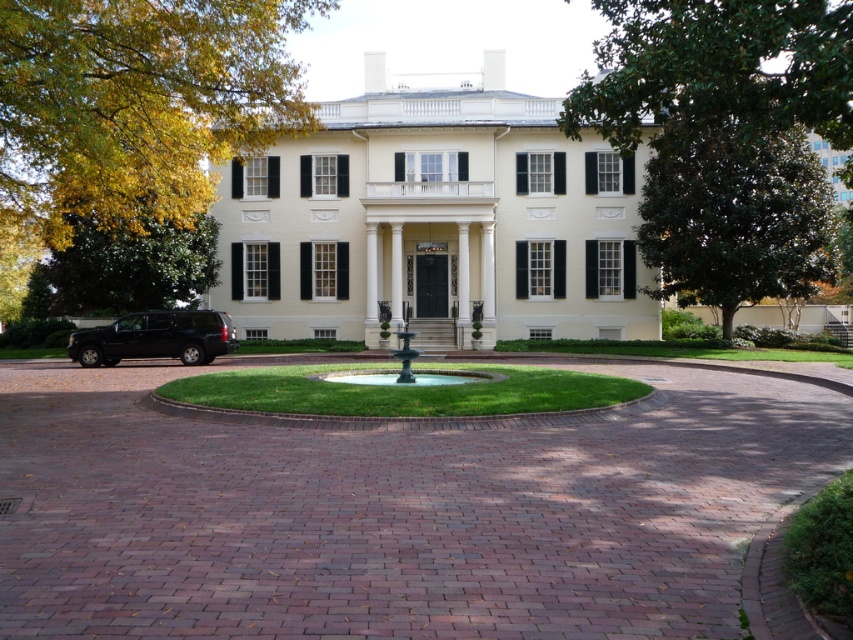
You are standing in front of the mansion and want to walk from the brick at center to the yellow leafy tree at upper left. Which direction should you move relative to the mansion?

Since the brick at center is closer to the viewer than the yellow leafy tree at upper left, you should move away from the mansion towards the yellow leafy tree at upper left.

You are standing at the center of the circular brick area in front of the mansion. Looking towards the front porch, can you see the yellow leafy tree at upper left from this vantage point?

Yes, because the yellow leafy tree at upper left is located at point (138, 104), which is in the upper left corner of the image, so it should be visible from the center of the circular brick area facing the front porch.